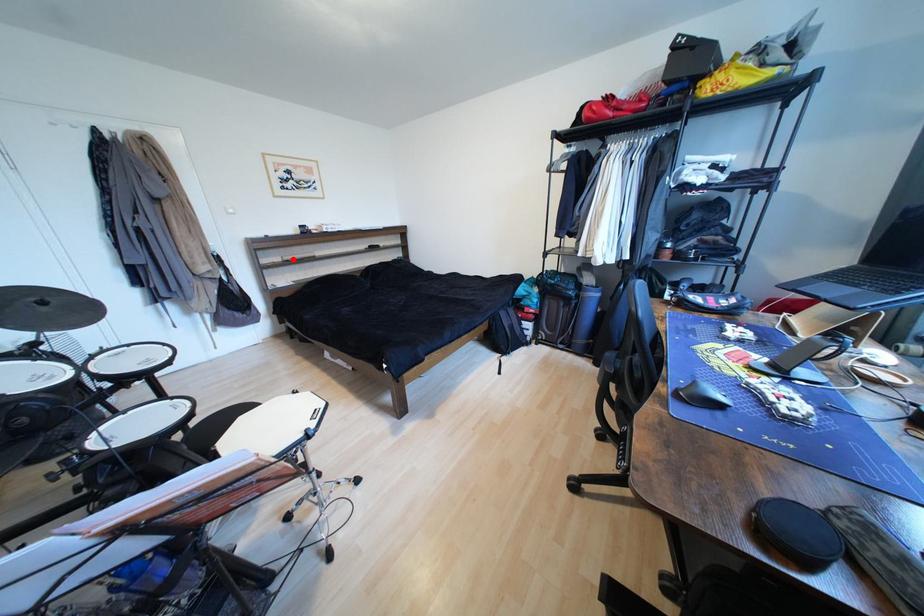
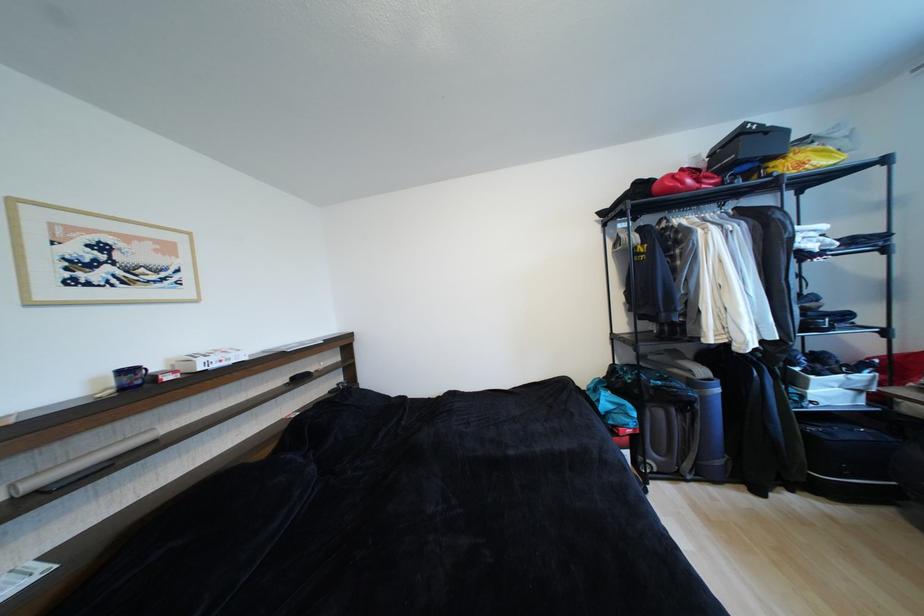
Question: I am providing you with two images of the same scene from different viewpoints. Given a red point in image1, look at the same physical point in image2. Is it:

Choices:
 (A) Closer to the viewpoint
 (B) Farther from the viewpoint

Answer: (B)